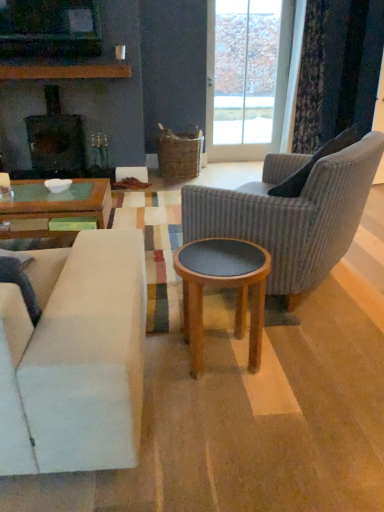
This screenshot has width=384, height=512. Identify the location of white glossy bowl at center. (58, 185).

Describe the element at coordinates (270, 99) in the screenshot. I see `transparent glass door at upper center` at that location.

The image size is (384, 512). What are the coordinates of `dark gray fabric pillow at right` in the screenshot? It's located at (314, 164).

The width and height of the screenshot is (384, 512). Describe the element at coordinates (49, 28) in the screenshot. I see `matte black television at upper left` at that location.

Identify the location of woven brown picnic basket at center. The height and width of the screenshot is (512, 384). (179, 154).

What are the coordinates of `white fabric couch at left` in the screenshot? It's located at (75, 358).

Are white fabric couch at left and transparent glass door at upper center far apart?

That's right, there is a large distance between white fabric couch at left and transparent glass door at upper center.

From a real-world perspective, is white fabric couch at left above or below transparent glass door at upper center?

In terms of real-world spatial position, white fabric couch at left is below transparent glass door at upper center.

Does white fabric couch at left have a greater width compared to transparent glass door at upper center?

Yes.

Which of these two, ribbed fabric armchair at right or transparent glass door at upper center, stands shorter?

ribbed fabric armchair at right.

Is ribbed fabric armchair at right spatially inside transparent glass door at upper center, or outside of it?

ribbed fabric armchair at right is spatially situated outside transparent glass door at upper center.

Is ribbed fabric armchair at right positioned far away from transparent glass door at upper center?

Yes, ribbed fabric armchair at right and transparent glass door at upper center are quite far apart.

The width and height of the screenshot is (384, 512). Identify the location of glass door lying above the ribbed fabric armchair at right (from the image's perspective). (270, 99).

Considering the sizes of objects ribbed fabric armchair at right and wooden round stool at center in the image provided, who is smaller, ribbed fabric armchair at right or wooden round stool at center?

wooden round stool at center.

Can you confirm if ribbed fabric armchair at right is shorter than wooden round stool at center?

No.

Looking at this image, considering the sizes of objects ribbed fabric armchair at right and wooden round stool at center in the image provided, who is thinner, ribbed fabric armchair at right or wooden round stool at center?

wooden round stool at center.

Find the location of a particular element. coffee table on the left of ribbed fabric armchair at right is located at coordinates (223, 287).

Is dark gray fabric pillow at right turned away from woven brown picnic basket at center?

No, dark gray fabric pillow at right is not facing the opposite direction of woven brown picnic basket at center.

From a real-world perspective, is dark gray fabric pillow at right located beneath woven brown picnic basket at center?

No, from a real-world perspective, dark gray fabric pillow at right is not below woven brown picnic basket at center.

Considering the points (49, 188) and (11, 362), which point is in front, point (49, 188) or point (11, 362)?

Positioned in front is point (11, 362).

Locate an element on the screen. This screenshot has width=384, height=512. bowl that is above the white fabric couch at left (from the image's perspective) is located at coordinates (58, 185).

Can you confirm if white glossy bowl at center is shorter than white fabric couch at left?

Correct, white glossy bowl at center is not as tall as white fabric couch at left.

Is white glossy bowl at center oriented away from white fabric couch at left?

Yes, white glossy bowl at center is positioned with its back facing white fabric couch at left.

Consider the image. From the image's perspective, which one is positioned lower, dark gray fabric pillow at right or matte black fireplace at center?

dark gray fabric pillow at right, from the image's perspective.

Can you tell me how much dark gray fabric pillow at right and matte black fireplace at center differ in facing direction?

The facing directions of dark gray fabric pillow at right and matte black fireplace at center are 127 degrees apart.

Considering the sizes of objects dark gray fabric pillow at right and matte black fireplace at center in the image provided, who is thinner, dark gray fabric pillow at right or matte black fireplace at center?

Thinner between the two is dark gray fabric pillow at right.

Considering their positions, is transparent glass door at upper center located in front of or behind ribbed fabric armchair at right?

transparent glass door at upper center is positioned farther from the viewer than ribbed fabric armchair at right.

Is transparent glass door at upper center thinner than ribbed fabric armchair at right?

Correct, the width of transparent glass door at upper center is less than that of ribbed fabric armchair at right.

From a real-world perspective, is transparent glass door at upper center physically above ribbed fabric armchair at right?

Yes, from a real-world perspective, transparent glass door at upper center is on top of ribbed fabric armchair at right.

Where is `studio couch in front of the transparent glass door at upper center`? This screenshot has height=512, width=384. studio couch in front of the transparent glass door at upper center is located at coordinates (75, 358).

The image size is (384, 512). I want to click on chair below the transparent glass door at upper center (from the image's perspective), so click(x=293, y=217).

When comparing their distances from matte black television at upper left, does matte black fireplace at center or dark gray fabric pillow at right seem further?

dark gray fabric pillow at right is further to matte black television at upper left.

Based on their spatial positions, is matte black fireplace at center or white glossy bowl at center further from dark gray fabric pillow at right?

The object further to dark gray fabric pillow at right is matte black fireplace at center.

From the image, which object appears to be farther from white fabric couch at left, velvet dark blue curtain at upper right or transparent glass door at upper center?

Among the two, transparent glass door at upper center is located further to white fabric couch at left.

Based on their spatial positions, is wooden round stool at center or velvet dark blue curtain at upper right further from transparent glass door at upper center?

wooden round stool at center is positioned further to the anchor transparent glass door at upper center.

Considering their positions, is matte black fireplace at center positioned further to velvet dark blue curtain at upper right than wooden round stool at center?

wooden round stool at center is positioned further to the anchor velvet dark blue curtain at upper right.

Based on their spatial positions, is white fabric couch at left or white glossy bowl at center further from wooden round stool at center?

Among the two, white glossy bowl at center is located further to wooden round stool at center.

Considering their positions, is transparent glass door at upper center positioned further to woven brown picnic basket at center than ribbed fabric armchair at right?

Based on the image, ribbed fabric armchair at right appears to be further to woven brown picnic basket at center.

When comparing their distances from velvet dark blue curtain at upper right, does dark gray fabric pillow at right or white glossy bowl at center seem further?

white glossy bowl at center.

The image size is (384, 512). Find the location of `curtain between ribbed fabric armchair at right and woven brown picnic basket at center from front to back`. curtain between ribbed fabric armchair at right and woven brown picnic basket at center from front to back is located at coordinates (x=337, y=70).

Identify the location of curtain between ribbed fabric armchair at right and transparent glass door at upper center in the front-back direction. (337, 70).

Find the location of `picnic basket located between ribbed fabric armchair at right and transparent glass door at upper center in the depth direction`. picnic basket located between ribbed fabric armchair at right and transparent glass door at upper center in the depth direction is located at coordinates (179, 154).

Identify the location of chair between wooden round stool at center and transparent glass door at upper center along the z-axis. (293, 217).